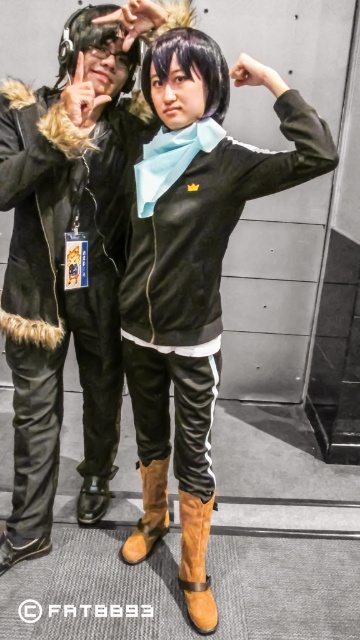
Question: Can you confirm if leather jacket at left is wider than suede boot at lower center?

Choices:
 (A) no
 (B) yes

Answer: (B)

Question: Among these points, which one is nearest to the camera?

Choices:
 (A) (200, 564)
 (B) (162, 497)
 (C) (142, 115)

Answer: (C)

Question: Which point is closer to the camera taking this photo?

Choices:
 (A) (200, 513)
 (B) (111, 468)

Answer: (A)

Question: Is leather jacket at left closer to the viewer compared to suede boot at lower center?

Choices:
 (A) no
 (B) yes

Answer: (B)

Question: Which of the following is the closest to the observer?

Choices:
 (A) suede boot at lower center
 (B) leather jacket at left
 (C) brown suede boot at lower center

Answer: (B)

Question: Does leather jacket at left have a lesser width compared to brown suede boot at lower center?

Choices:
 (A) yes
 (B) no

Answer: (B)